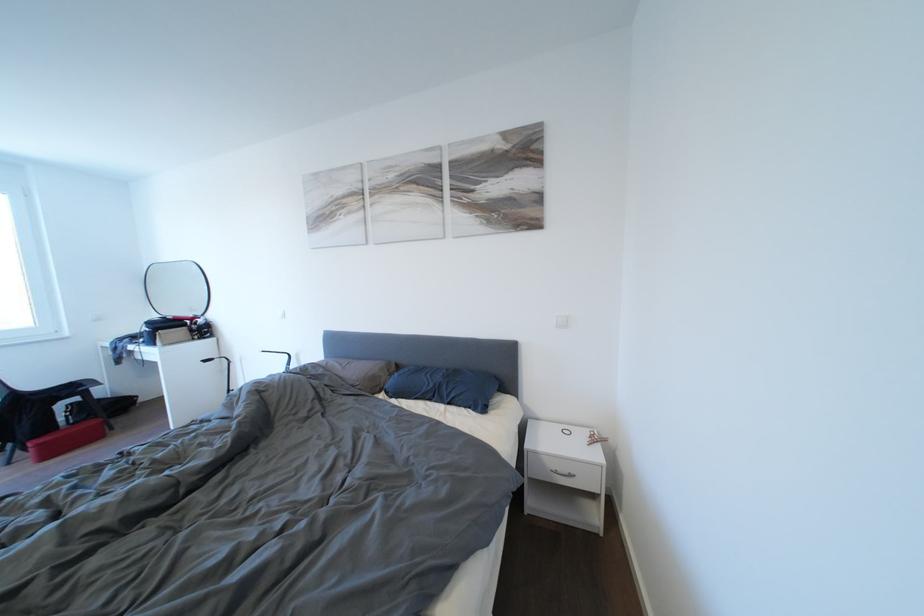
The image size is (924, 616). I want to click on brown pillow, so click(360, 371).